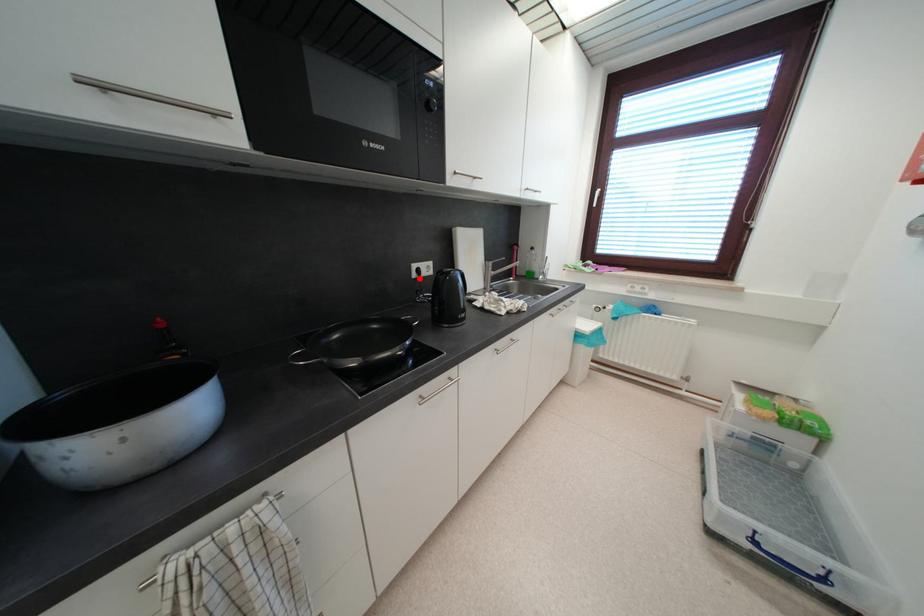
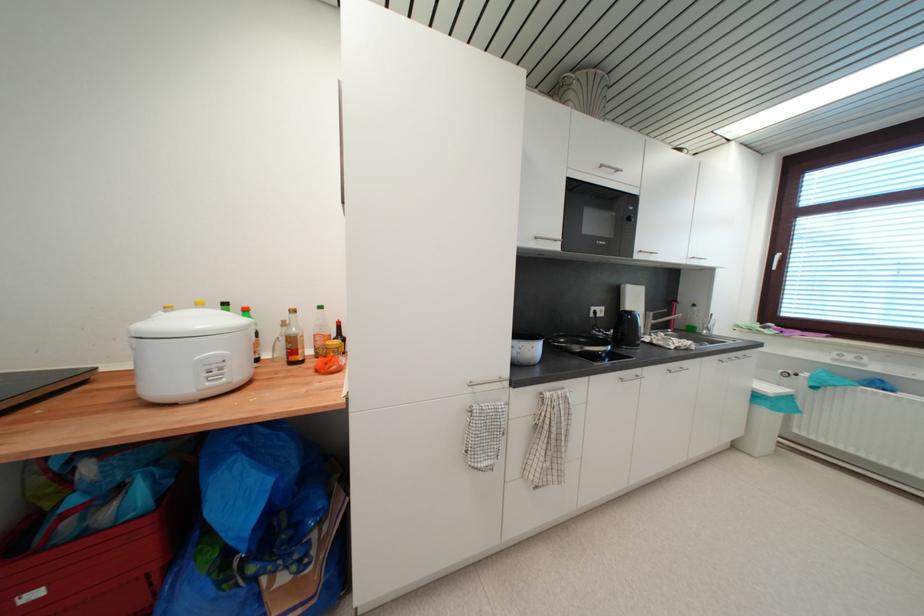
Locate, in the second image, the point that corresponds to the highlighted location in the first image.

(597, 317)